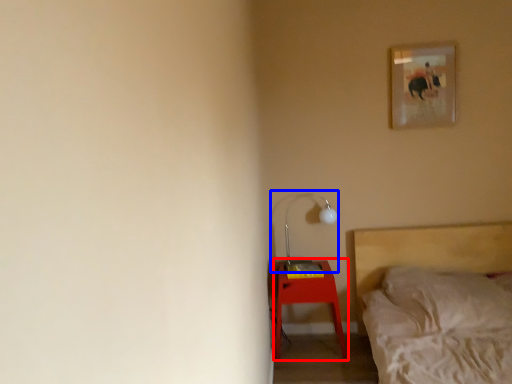
Question: Which object appears closest to the camera in this image, nightstand (highlighted by a red box) or table lamp (highlighted by a blue box)?

Choices:
 (A) nightstand
 (B) table lamp

Answer: (A)